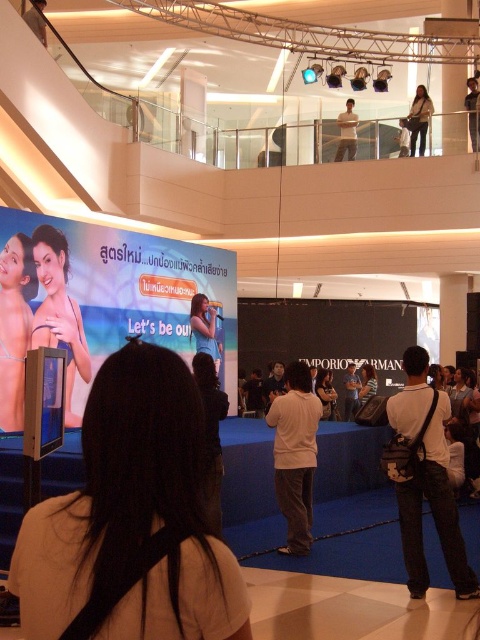
Based on the photo, you are a photographer who needs to capture both the matte black bikini at left and the matte black dress at center in a single frame. Based on their positions, which object should you focus on first to ensure both are in the frame?

The matte black bikini at left is to the left of the matte black dress at center, so you should focus on the matte black bikini at left first to ensure both are in the frame.

Consider the image. You are a store manager organizing a promotional display. You have a matte black bikini at left and a matte black jacket at upper right. The display area has a width limit of 1.2 meters. Which item should be placed first to ensure both fit within the display area?

The matte black bikini at left is wider than the matte black jacket at upper right. To ensure both fit within the 1.2 meters width limit, place the narrower matte black jacket at upper right first, then the wider matte black bikini at left if there is remaining space.

You are standing in the shopping mall and see two points marked in the image. Which point is closer to you, point (59, 291) or point (419, 115)?

Point (59, 291) is closer to the viewer than point (419, 115).